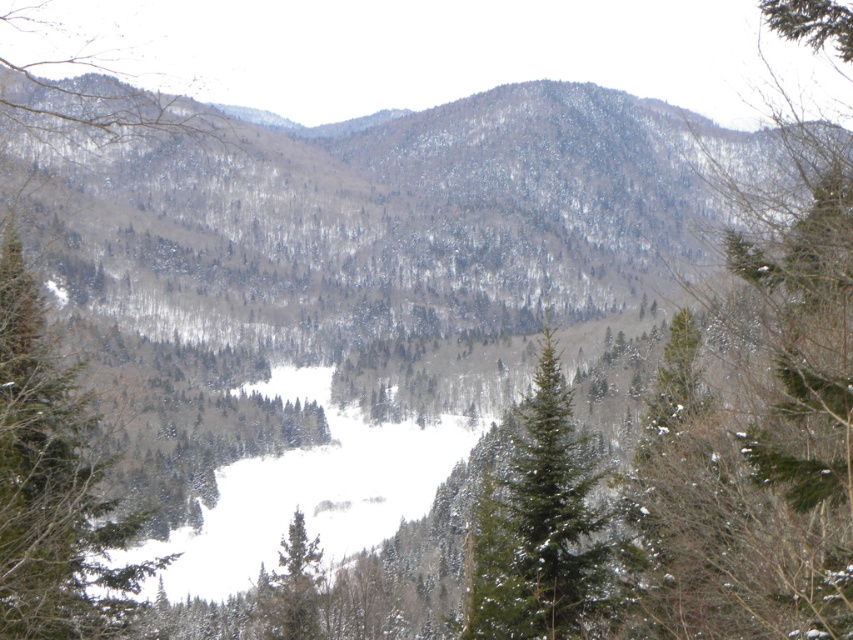
You are standing in the winter landscape and want to take a photo. There are two points marked in the image, point at coordinate (86,499) and point at coordinate (271,579). Which point is closer to you?

Point at coordinate (86,499) is closer to you than point at coordinate (271,579).